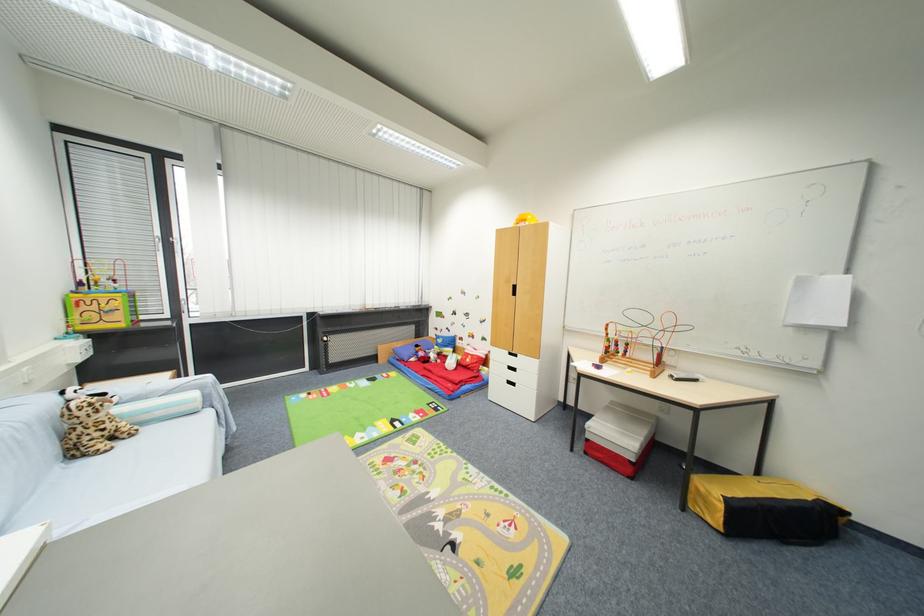
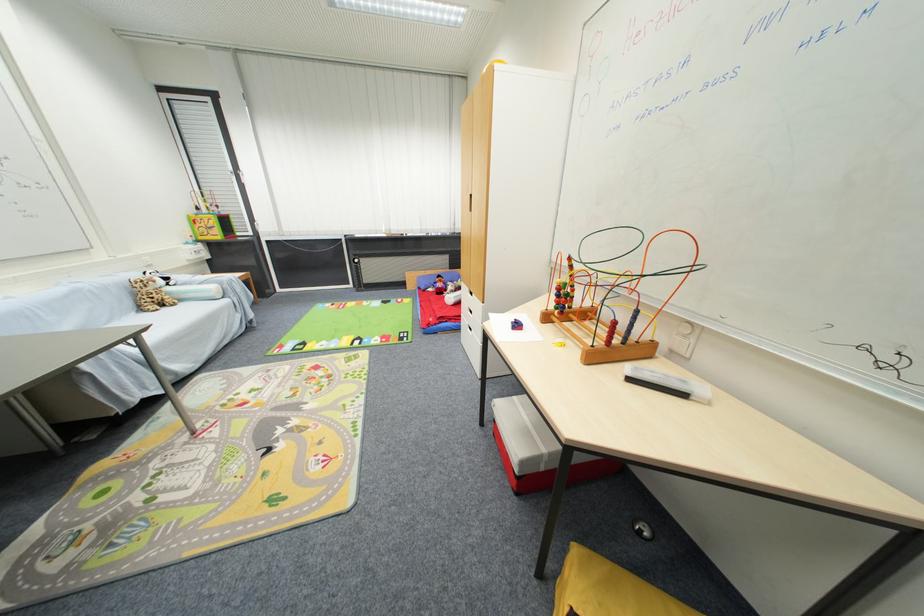
Locate, in the second image, the point that corresponds to point (200, 397) in the first image.

(217, 290)